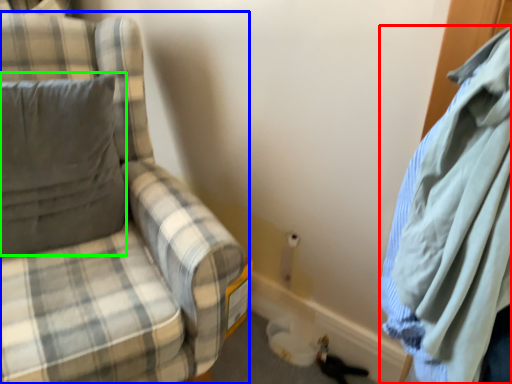
Question: Based on their relative distances, which object is nearer to cloak (highlighted by a red box)? Choose from chair (highlighted by a blue box) and pillow (highlighted by a green box).

Choices:
 (A) chair
 (B) pillow

Answer: (A)